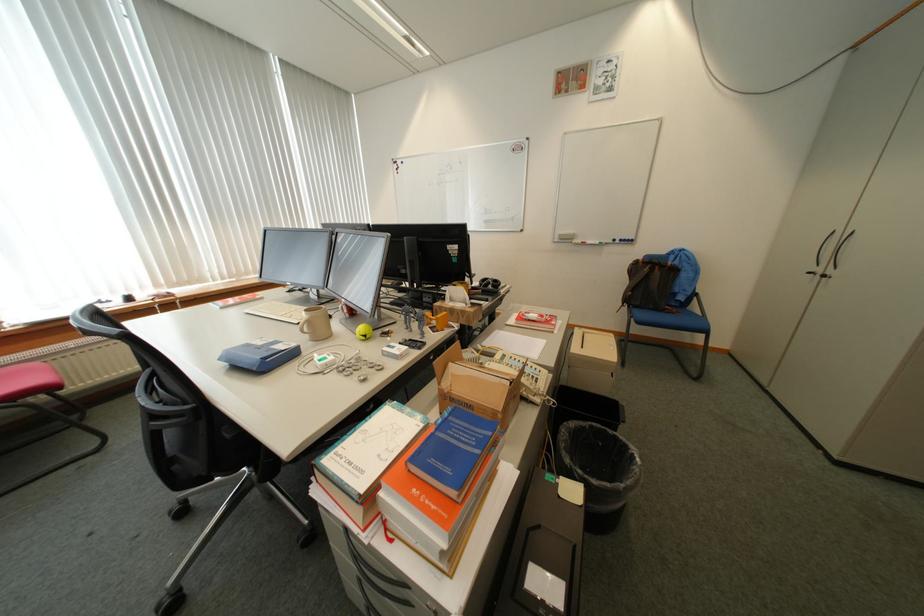
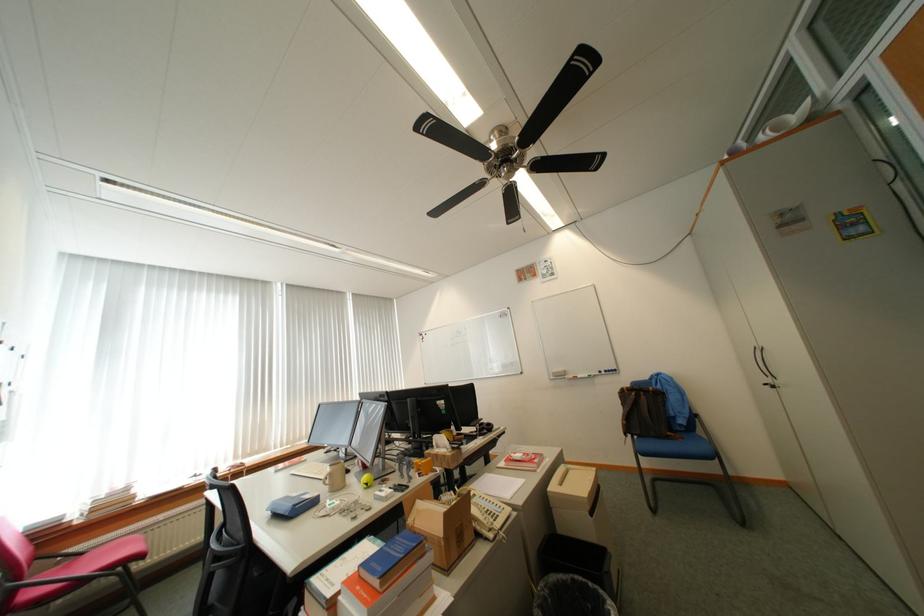
The point at (346, 326) is marked in the first image. Where is the corresponding point in the second image?

(360, 479)